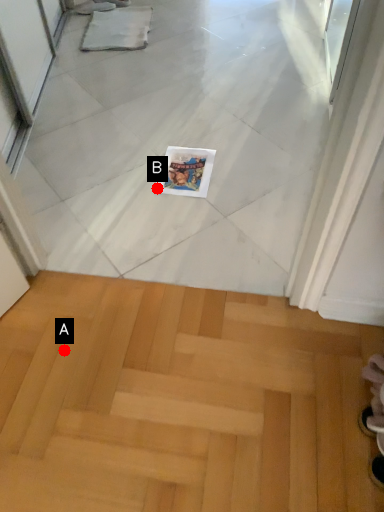
Question: Two points are circled on the image, labeled by A and B beside each circle. Which point is further to the camera?

Choices:
 (A) A is further
 (B) B is further

Answer: (B)